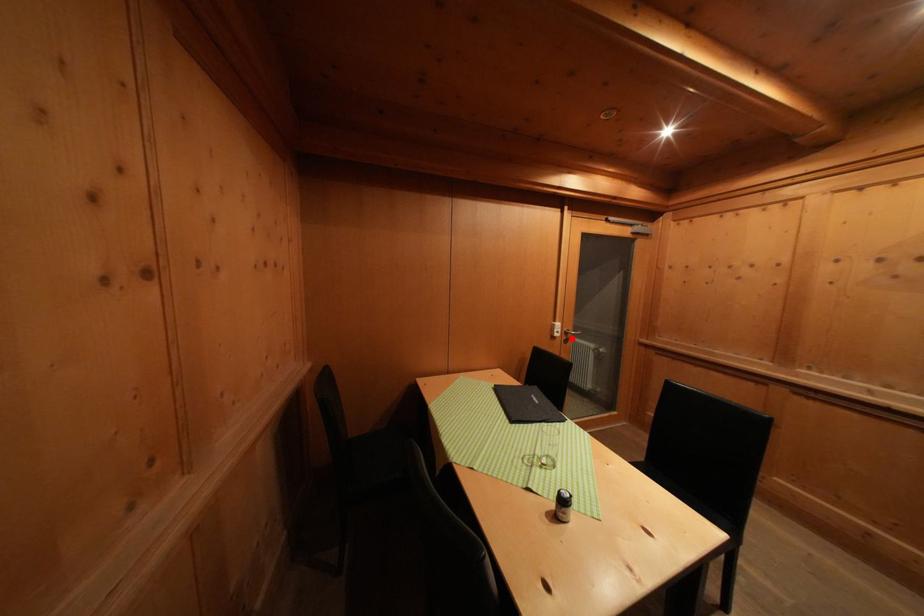
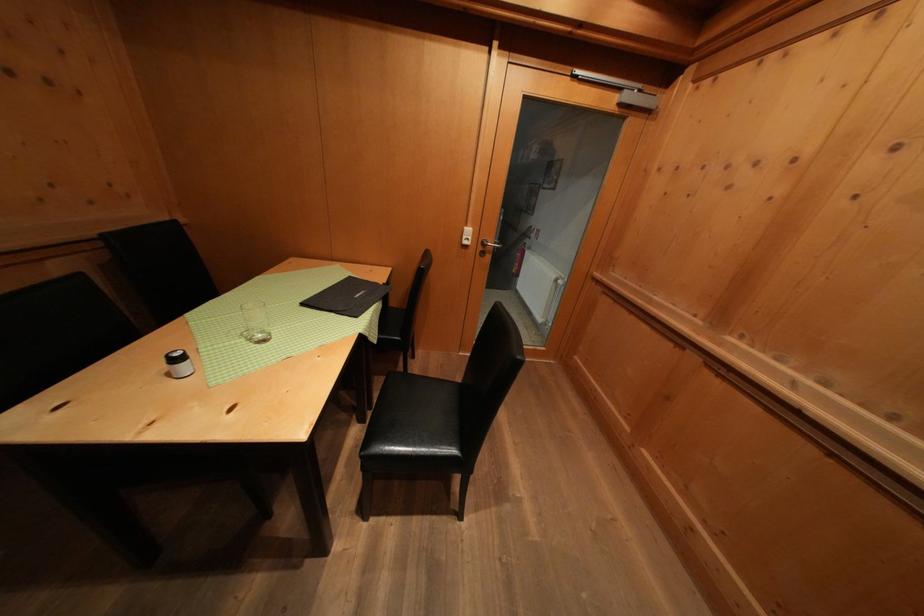
In the second image, find the point that corresponds to the highlighted location in the first image.

(490, 249)